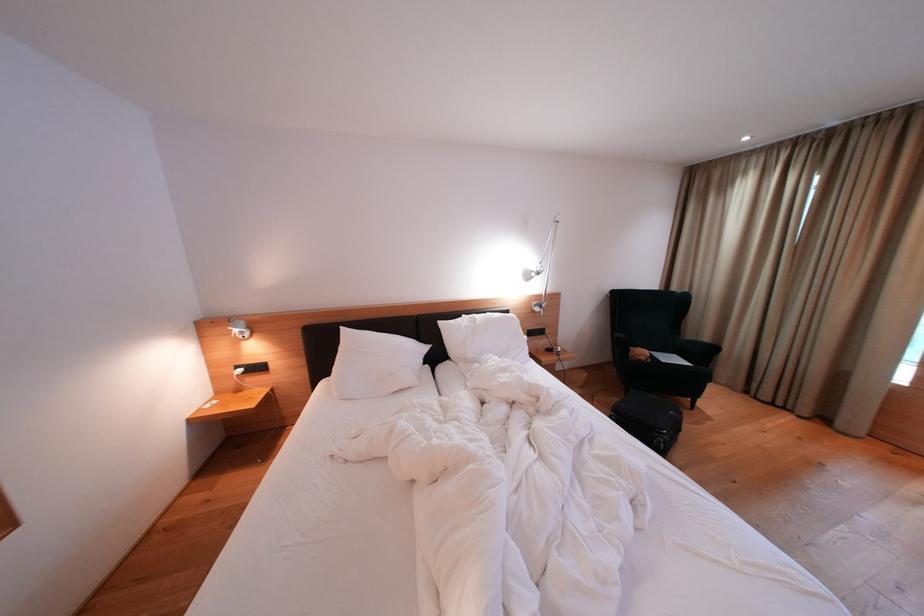
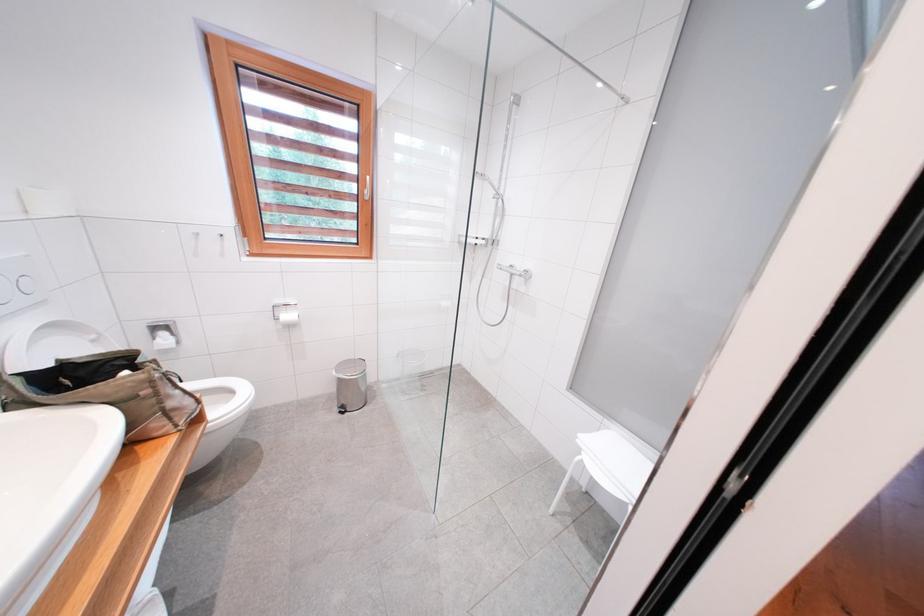
Question: What movement of the cameraman would produce the second image?

Choices:
 (A) Left
 (B) Right
 (C) Forward
 (D) Backward

Answer: (A)